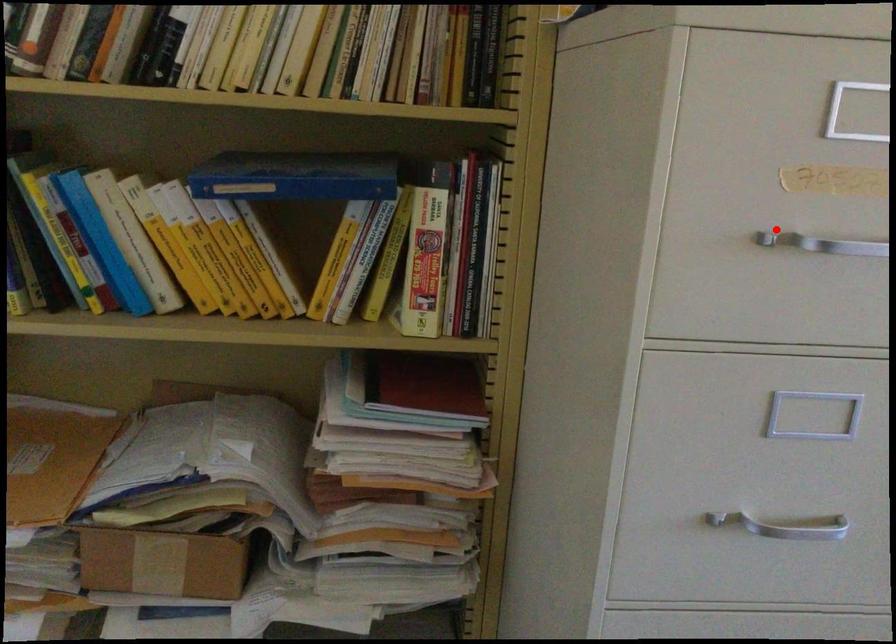
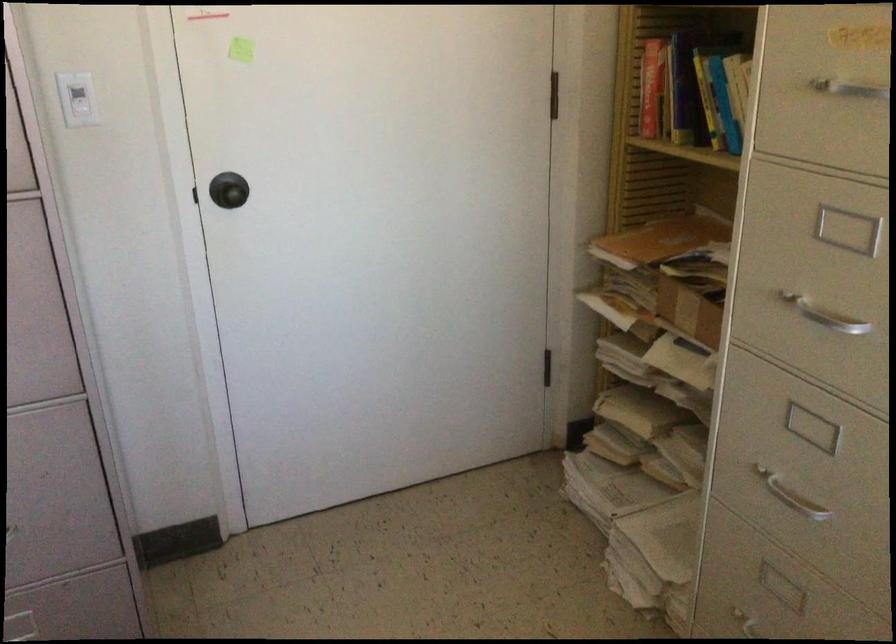
Find the pixel in the second image that matches the highlighted location in the first image.

(839, 82)